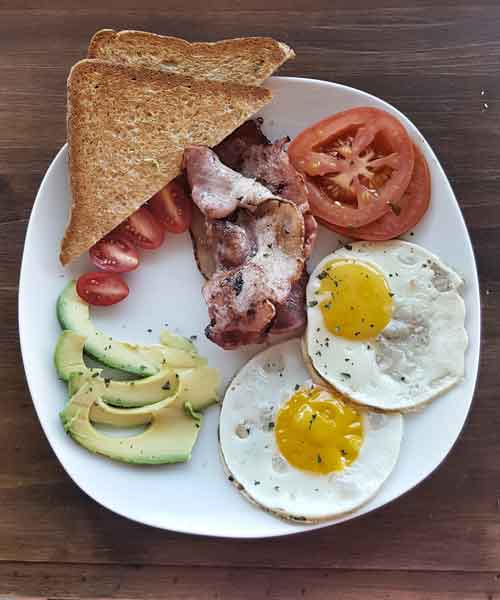
The width and height of the screenshot is (500, 600). I want to click on top of wooden table, so click(x=63, y=538).